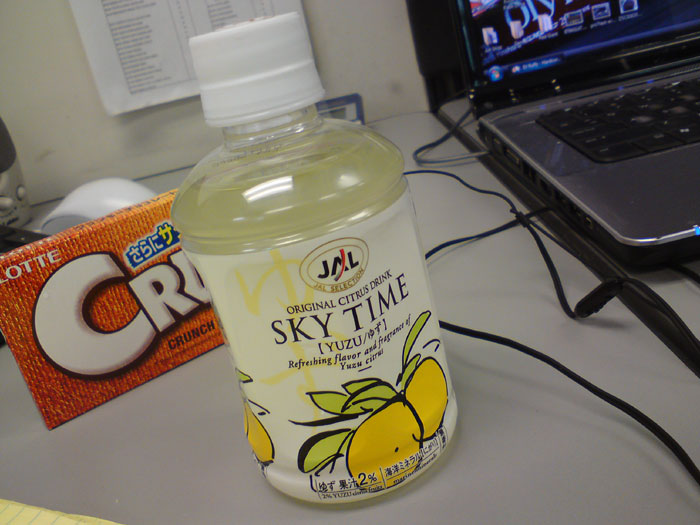
Image resolution: width=700 pixels, height=525 pixels. Identify the location of keyboard. (642, 121).